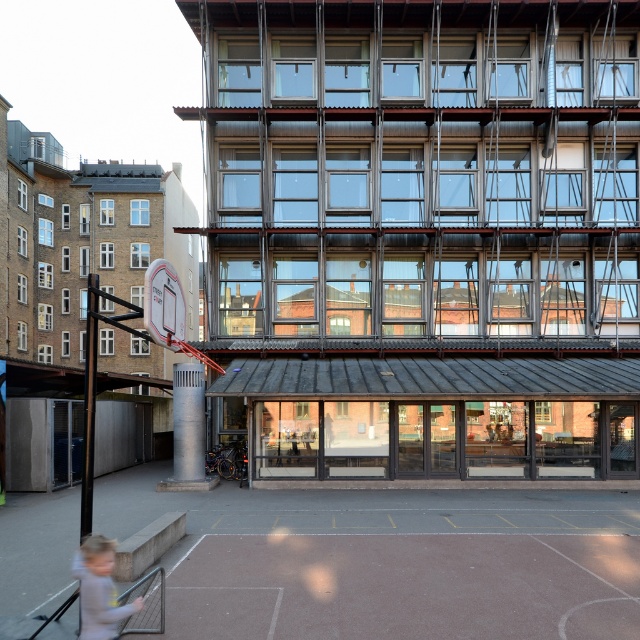
You are a photographer setting up equipment for an event. You have a light gray fabric at lower left and a metallic silver basketball hoop at center in your viewfinder. Which object should you adjust your camera angle to include more of if you want to emphasize the larger object in the scene?

You should adjust your camera angle to include more of the light gray fabric at lower left because its width is larger than the metallic silver basketball hoop at center.

You are standing at the entrance of the building and want to place a large banner on the ground. The banner is 2 meters wide. There is a light gray fabric at lower left and a white plastic basketball hoop at left. Can you fit the banner between them?

The light gray fabric at lower left is to the right of the white plastic basketball hoop at left. Since the banner is 2 meters wide, you need to check the distance between them. However, the description does not provide the exact distance between the two objects, so it is unclear if the banner will fit.